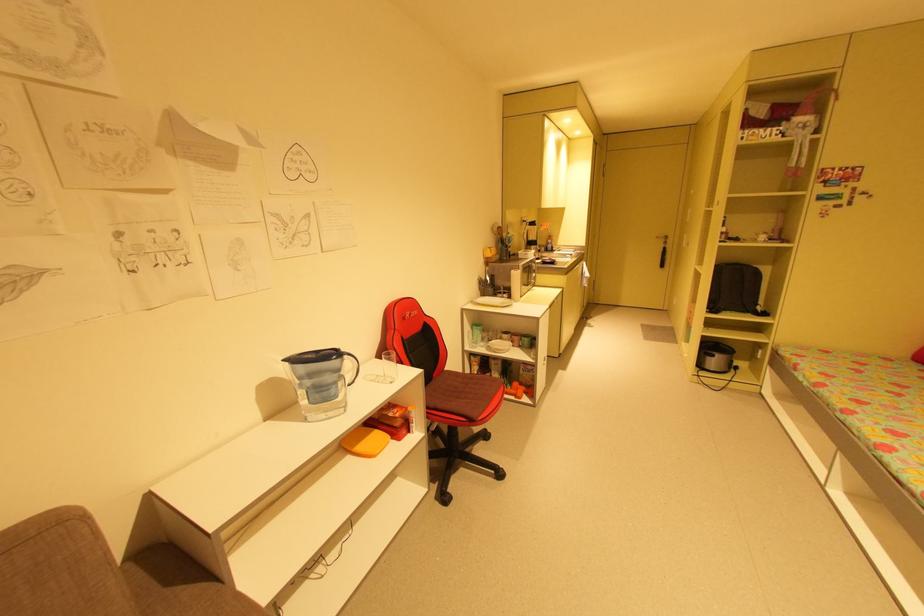
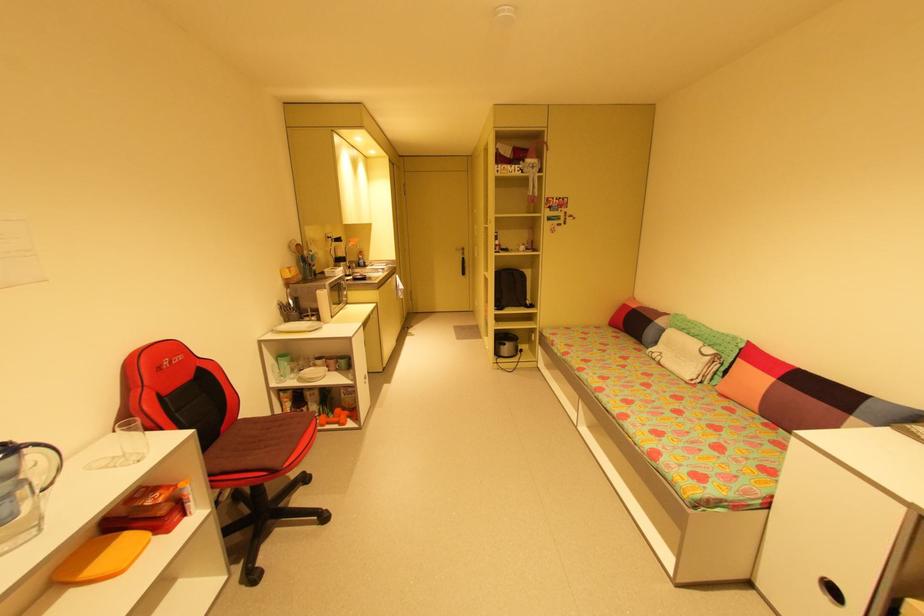
Locate, in the second image, the point that corresponds to pixel 712 358 in the first image.

(505, 347)